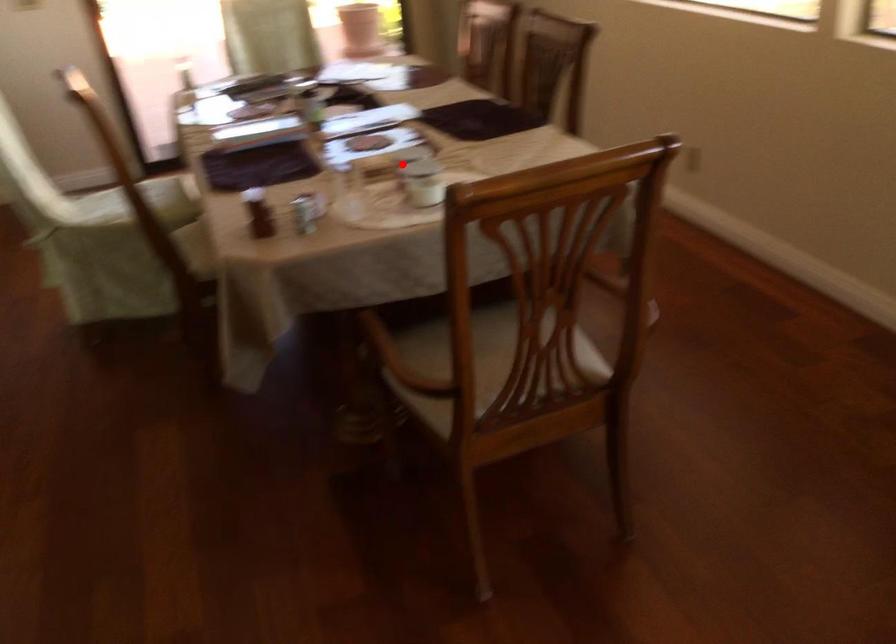
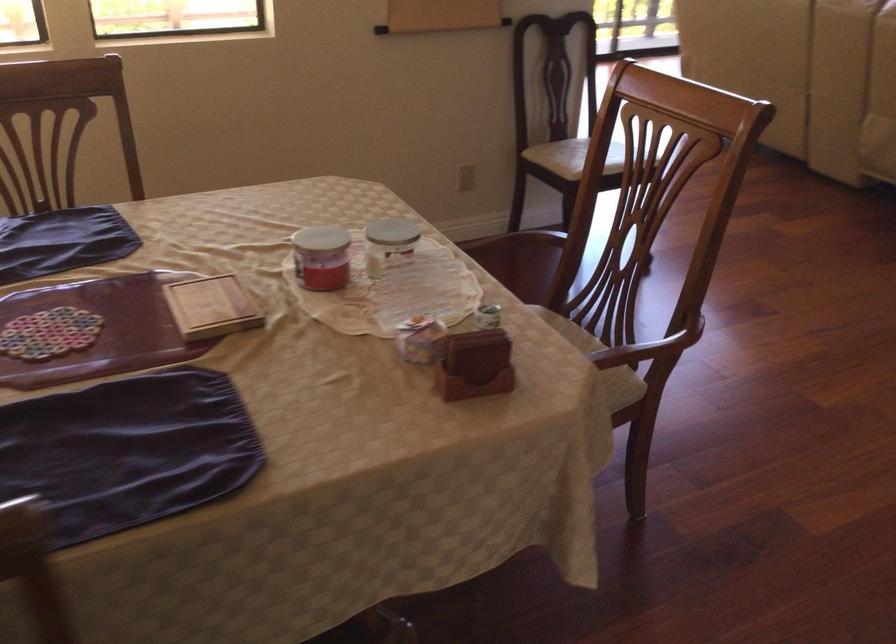
In the second image, find the point that corresponds to the highlighted location in the first image.

(321, 257)